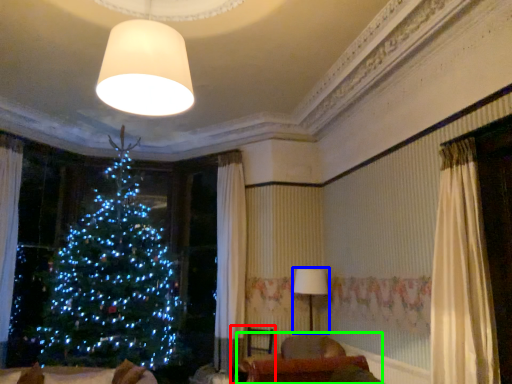
Question: Estimate the real-world distances between objects in this image. Which object is closer to armchair (highlighted by a red box), lamp (highlighted by a blue box) or furniture (highlighted by a green box)?

Choices:
 (A) lamp
 (B) furniture

Answer: (A)